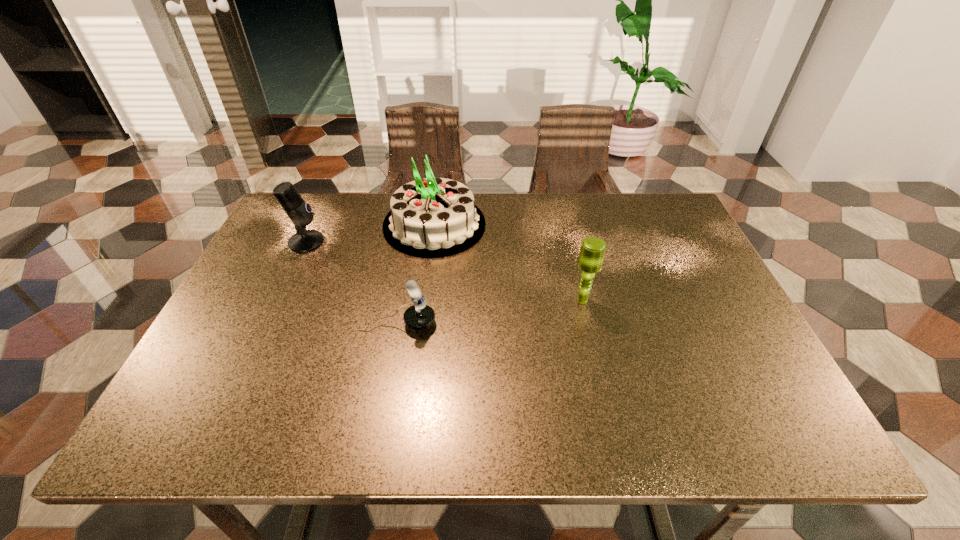
Locate an element on the screen. birthday cake is located at coordinates (432, 217).

You are a GUI agent. You are given a task and a screenshot of the screen. Output one action in this format:
    pyautogui.click(x=<x>, y=<y>)
    Task: Click on the leftmost object
    
    Given the screenshot: What is the action you would take?
    pyautogui.click(x=300, y=213)

This screenshot has height=540, width=960. Identify the location of the leftmost microphone. (300, 213).

Image resolution: width=960 pixels, height=540 pixels. What are the coordinates of `the rightmost microphone` in the screenshot? It's located at (593, 249).

Identify the location of the second nearest object. The width and height of the screenshot is (960, 540). (593, 249).

Identify the location of the nearest object. Image resolution: width=960 pixels, height=540 pixels. (420, 316).

Find the location of `the nearest microphone`. the nearest microphone is located at coordinates (420, 316).

Image resolution: width=960 pixels, height=540 pixels. What are the coordinates of `free space located 0.200m on the left of the birthday cake` in the screenshot? It's located at (316, 225).

This screenshot has width=960, height=540. Identify the location of vacant space located 0.240m on the stand of the leftmost object. (408, 242).

Locate an element on the screen. vacant space located on the left of the rightmost object is located at coordinates click(433, 300).